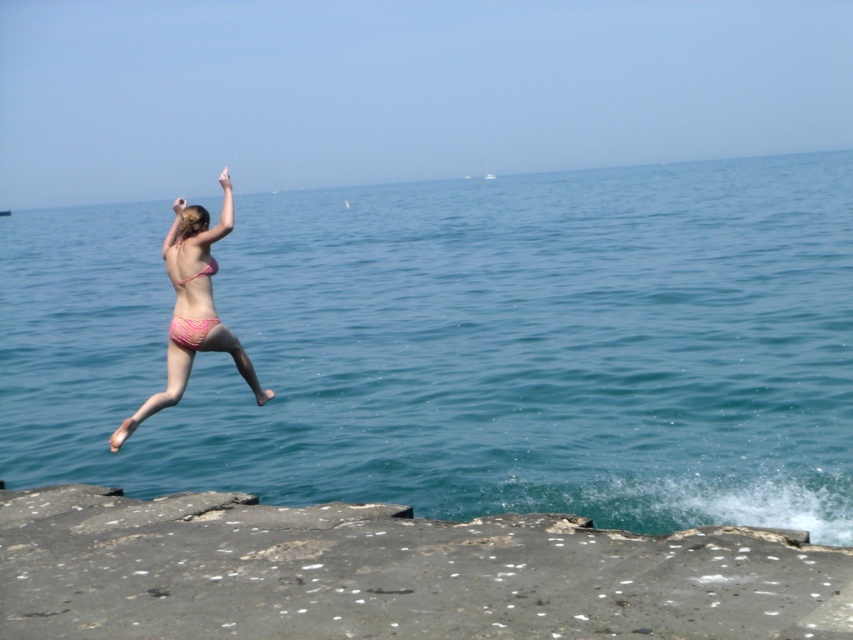
Can you confirm if blue water at center is positioned below pink bikini at center?

No, blue water at center is not below pink bikini at center.

Is point (283, 289) positioned after point (195, 289)?

Yes.

Is point (850, 496) farther from camera compared to point (225, 204)?

Yes, point (850, 496) is farther from viewer.

Where is `blue water at center`? This screenshot has height=640, width=853. blue water at center is located at coordinates (463, 346).

The width and height of the screenshot is (853, 640). I want to click on pink bikini at center, so click(192, 307).

Does pink bikini at center have a greater height compared to pink matte bikini top at center?

Yes, pink bikini at center is taller than pink matte bikini top at center.

You are a GUI agent. You are given a task and a screenshot of the screen. Output one action in this format:
    pyautogui.click(x=<x>, y=<y>)
    Task: Click on the pink bikini at center
    This screenshot has width=853, height=640.
    Given the screenshot: What is the action you would take?
    pyautogui.click(x=192, y=307)

Image resolution: width=853 pixels, height=640 pixels. Find the location of `pink bikini at center`. pink bikini at center is located at coordinates (192, 307).

Who is higher up, gray concrete cliff at lower left or pink fabric bikini at left?

pink fabric bikini at left is higher up.

Can you confirm if gray concrete cliff at lower left is bigger than pink fabric bikini at left?

Correct, gray concrete cliff at lower left is larger in size than pink fabric bikini at left.

Identify the location of gray concrete cliff at lower left. (393, 572).